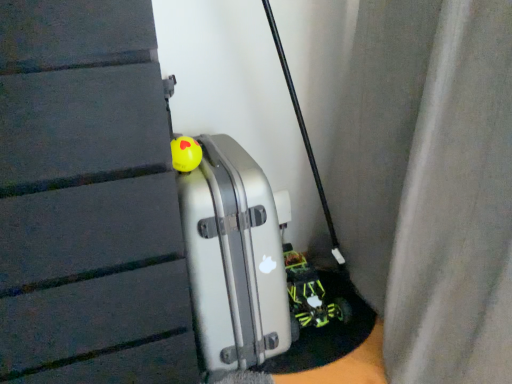
Question: Is neon green plastic toy car at lower right outside silver metallic suitcase at center?

Choices:
 (A) yes
 (B) no

Answer: (A)

Question: Is neon green plastic toy car at lower right not close to silver metallic suitcase at center?

Choices:
 (A) no
 (B) yes

Answer: (A)

Question: Is neon green plastic toy car at lower right to the left of silver metallic suitcase at center from the viewer's perspective?

Choices:
 (A) no
 (B) yes

Answer: (A)

Question: Is neon green plastic toy car at lower right to the right of silver metallic suitcase at center from the viewer's perspective?

Choices:
 (A) yes
 (B) no

Answer: (A)

Question: Does neon green plastic toy car at lower right touch silver metallic suitcase at center?

Choices:
 (A) yes
 (B) no

Answer: (B)

Question: Looking at their shapes, would you say neon green plastic toy car at lower right is wider or thinner than silver metallic suitcase at center?

Choices:
 (A) thin
 (B) wide

Answer: (A)

Question: Relative to silver metallic suitcase at center, is neon green plastic toy car at lower right in front or behind?

Choices:
 (A) behind
 (B) front

Answer: (A)

Question: In terms of height, does neon green plastic toy car at lower right look taller or shorter compared to silver metallic suitcase at center?

Choices:
 (A) short
 (B) tall

Answer: (A)

Question: Choose the correct answer: Is neon green plastic toy car at lower right inside silver metallic suitcase at center or outside it?

Choices:
 (A) outside
 (B) inside

Answer: (A)

Question: From the image's perspective, is silver metallic suitcase at center above or below yellow rubber ball at center?

Choices:
 (A) below
 (B) above

Answer: (A)

Question: Relative to yellow rubber ball at center, is silver metallic suitcase at center in front or behind?

Choices:
 (A) front
 (B) behind

Answer: (A)

Question: Considering the relative positions of silver metallic suitcase at center and yellow rubber ball at center in the image provided, is silver metallic suitcase at center to the left or to the right of yellow rubber ball at center?

Choices:
 (A) left
 (B) right

Answer: (B)

Question: From a real-world perspective, is silver metallic suitcase at center physically located above or below yellow rubber ball at center?

Choices:
 (A) above
 (B) below

Answer: (B)

Question: From the image's perspective, is silver metallic suitcase at center located above or below neon green plastic toy car at lower right?

Choices:
 (A) above
 (B) below

Answer: (A)

Question: In the image, is silver metallic suitcase at center on the left side or the right side of neon green plastic toy car at lower right?

Choices:
 (A) right
 (B) left

Answer: (B)